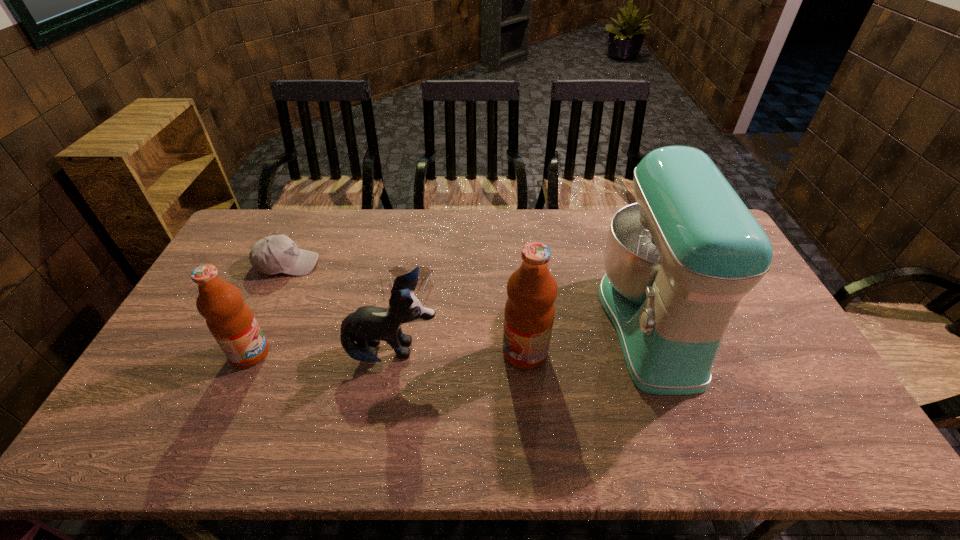
Find the location of `the shorter fruit juice`. the shorter fruit juice is located at coordinates (230, 320).

The height and width of the screenshot is (540, 960). What are the coordinates of `the right fruit juice` in the screenshot? It's located at (529, 313).

The width and height of the screenshot is (960, 540). I want to click on the second object from right to left, so click(529, 313).

Image resolution: width=960 pixels, height=540 pixels. I want to click on spectacles, so [x=424, y=272].

This screenshot has height=540, width=960. What are the coordinates of `baseball cap` in the screenshot? It's located at (274, 254).

Identify the location of the rightmost object. (678, 262).

Where is `the tallest object`? the tallest object is located at coordinates (678, 262).

The image size is (960, 540). In order to click on puppy in this screenshot , I will do `click(368, 325)`.

Locate an element on the screen. free space located 0.360m on the front label of the left fruit juice is located at coordinates (398, 354).

This screenshot has width=960, height=540. Find the location of `vacant space located 0.310m on the front label of the taller fruit juice`. vacant space located 0.310m on the front label of the taller fruit juice is located at coordinates (391, 353).